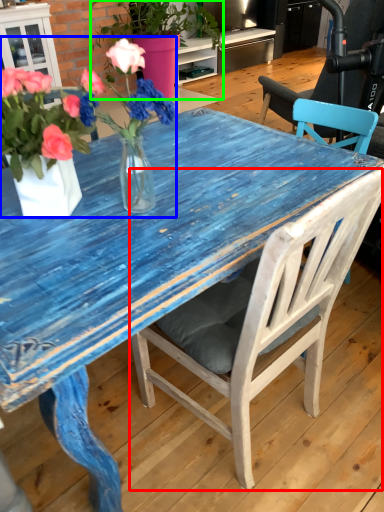
Question: Which object is positioned farthest from chair (highlighted by a red box)? Select from floral arrangement (highlighted by a blue box) and houseplant (highlighted by a green box).

Choices:
 (A) floral arrangement
 (B) houseplant

Answer: (B)